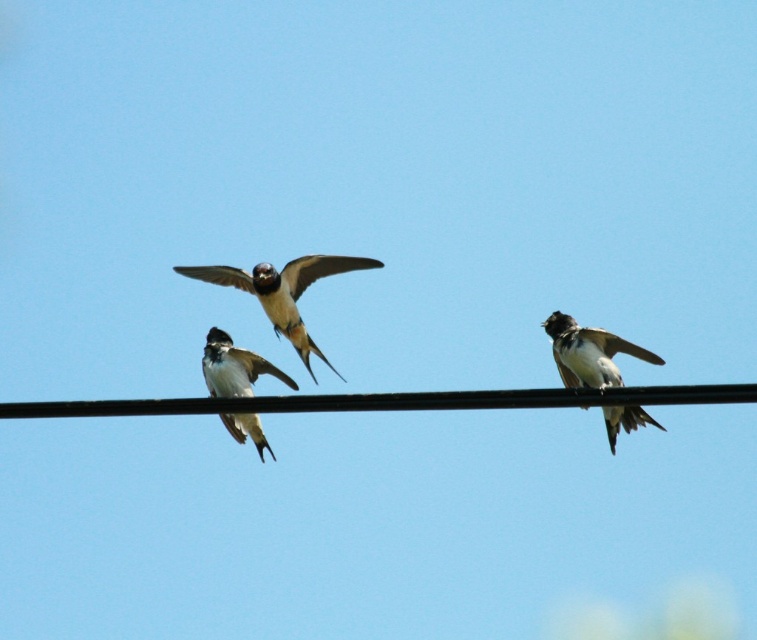
Question: Can you confirm if brown speckled feathers at center is positioned to the right of black and white feathers at center?

Choices:
 (A) yes
 (B) no

Answer: (A)

Question: Which object is farther from the camera taking this photo?

Choices:
 (A) black wire at center
 (B) brown speckled feathers at center
 (C) black and white feathers at center

Answer: (B)

Question: Which object is closer to the camera taking this photo?

Choices:
 (A) black wire at center
 (B) white-feathered bird at center
 (C) brown speckled feathers at center
 (D) black and white feathers at center

Answer: (A)

Question: Is black wire at center above brown speckled feathers at center?

Choices:
 (A) yes
 (B) no

Answer: (B)

Question: Which of the following is the closest to the observer?

Choices:
 (A) (98, 403)
 (B) (578, 326)
 (C) (262, 372)
 (D) (310, 372)

Answer: (A)

Question: Is black wire at center above brown speckled feathers at center?

Choices:
 (A) yes
 (B) no

Answer: (B)